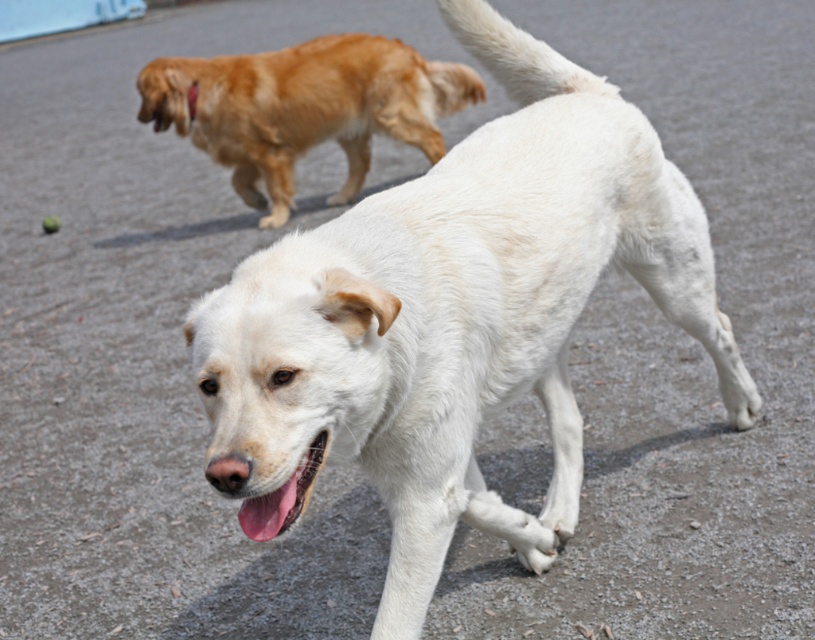
Question: Which of the following is the farthest from the observer?

Choices:
 (A) pink glossy tongue at center
 (B) white fur dog at center
 (C) golden fur dog at upper left

Answer: (C)

Question: Considering the real-world distances, which object is farthest from the pink glossy tongue at center?

Choices:
 (A) white fur dog at center
 (B) golden fur dog at upper left

Answer: (B)

Question: Is white fur dog at center positioned in front of pink glossy tongue at center?

Choices:
 (A) yes
 (B) no

Answer: (A)

Question: Which is nearer to the golden fur dog at upper left?

Choices:
 (A) pink glossy tongue at center
 (B) white fur dog at center

Answer: (B)

Question: Considering the relative positions of golden fur dog at upper left and pink glossy tongue at center in the image provided, where is golden fur dog at upper left located with respect to pink glossy tongue at center?

Choices:
 (A) right
 (B) left

Answer: (B)

Question: Is the position of golden fur dog at upper left less distant than that of pink glossy tongue at center?

Choices:
 (A) yes
 (B) no

Answer: (B)